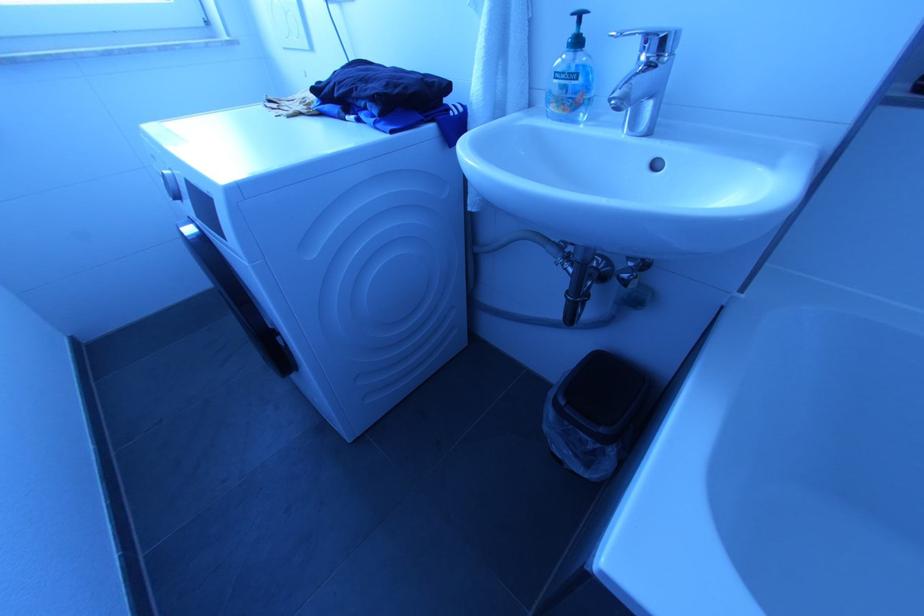
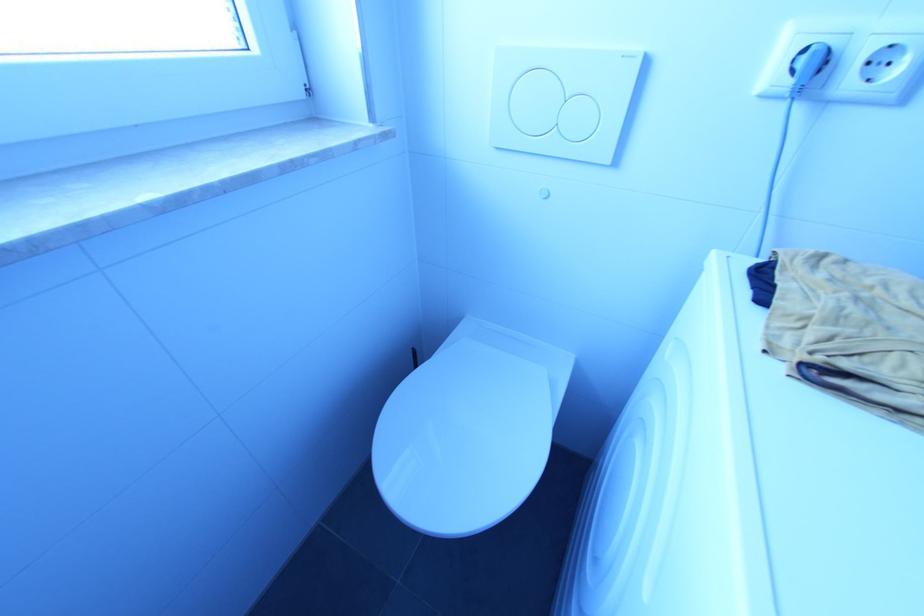
Which direction would the cameraman need to move to produce the second image?

The movement direction of the cameraman is left, forward.